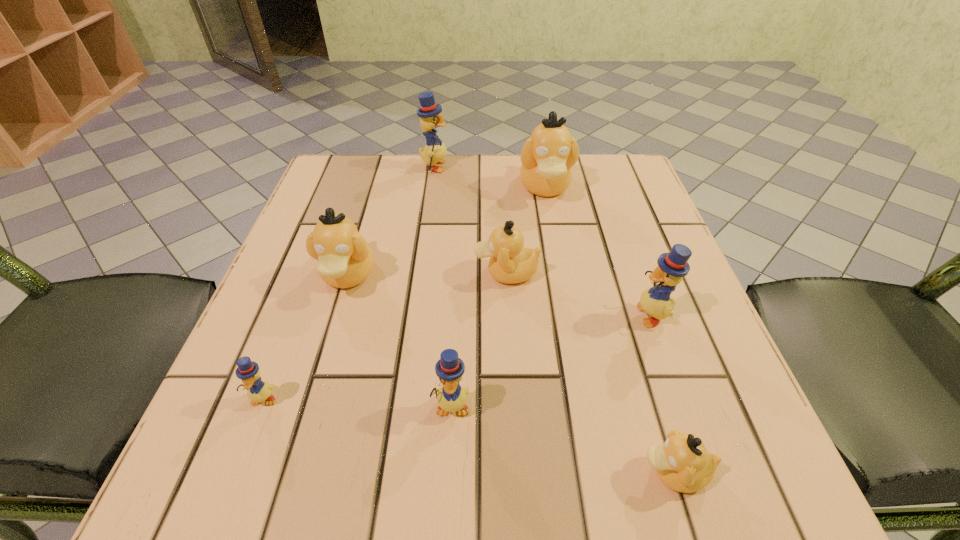
At what (x,y) coordinates should I click in order to perform the action: click on vacant space at the right edge. Please return your answer as a coordinate pair (x, y). This screenshot has width=960, height=540. Looking at the image, I should click on (612, 299).

In the image, there is a desktop. Where is `vacant area at the near left corner`? vacant area at the near left corner is located at coordinates (265, 501).

The width and height of the screenshot is (960, 540). In the image, there is a desktop. Identify the location of vacant space at the far right corner. [x=586, y=165].

What are the coordinates of `free space at the near right corner of the desktop` in the screenshot? It's located at (723, 485).

Image resolution: width=960 pixels, height=540 pixels. I want to click on vacant point located between the leftmost tan duckling and the nearest tan duckling, so click(511, 374).

Find the location of a particular element. This screenshot has width=960, height=540. vacant space that is in between the third smallest tan duckling and the nearest tan duckling is located at coordinates [x=511, y=374].

Identify the location of free space between the leftmost yellow duckling and the third biggest tan duckling. (385, 335).

This screenshot has width=960, height=540. I want to click on empty location between the leftmost tan duckling and the fourth object from left to right, so click(x=399, y=341).

You are a GUI agent. You are given a task and a screenshot of the screen. Output one action in this format:
    pyautogui.click(x=<x>, y=<y>)
    Task: Click on the unoccupied position between the nearest object and the farthest tan duckling
    
    Given the screenshot: What is the action you would take?
    pyautogui.click(x=610, y=330)

This screenshot has height=540, width=960. Find the location of `free space that is in between the second farthest yellow duckling and the second smallest tan duckling`. free space that is in between the second farthest yellow duckling and the second smallest tan duckling is located at coordinates (579, 293).